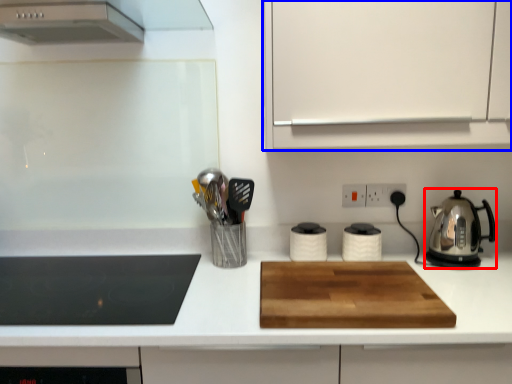
Question: Which object is further to the camera taking this photo, kitchen appliance (highlighted by a red box) or cabinetry (highlighted by a blue box)?

Choices:
 (A) kitchen appliance
 (B) cabinetry

Answer: (A)